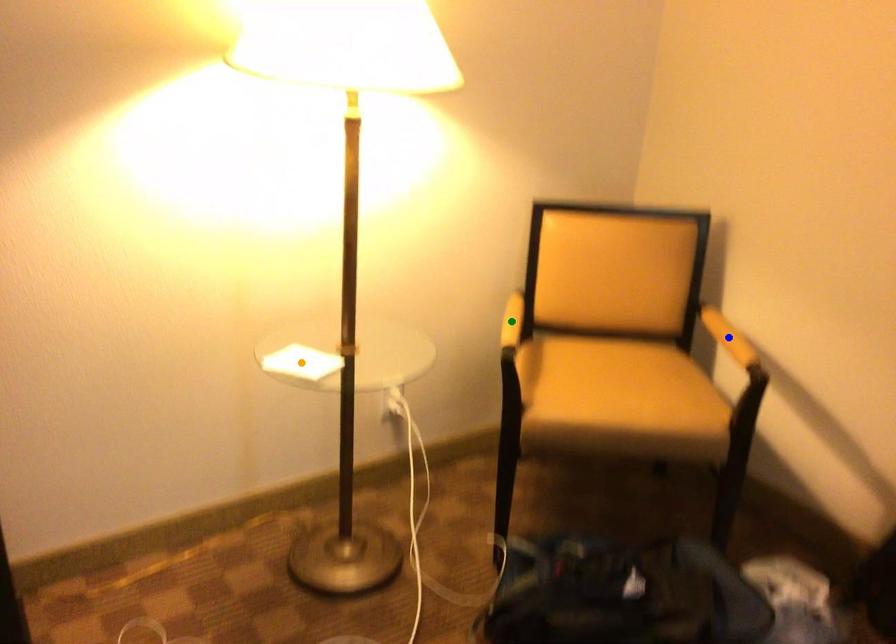
Order these from nearest to farthest:
1. blue point
2. green point
3. orange point

orange point < green point < blue point